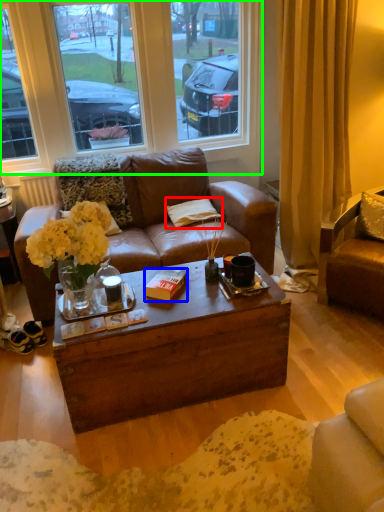
Question: Which is farther away from pillow (highlighted by a red box)? book (highlighted by a blue box) or window (highlighted by a green box)?

Choices:
 (A) book
 (B) window

Answer: (B)